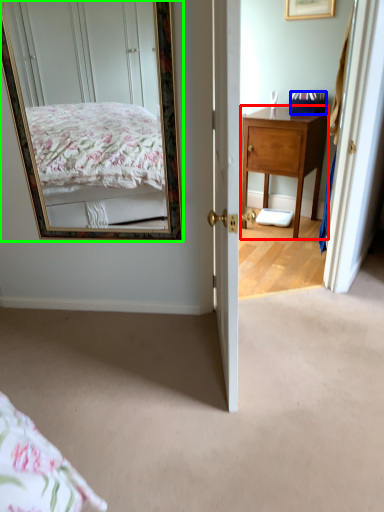
Question: Which object is positioned farthest from desk (highlighted by a red box)? Select from box (highlighted by a blue box) and mirror (highlighted by a green box).

Choices:
 (A) box
 (B) mirror

Answer: (B)